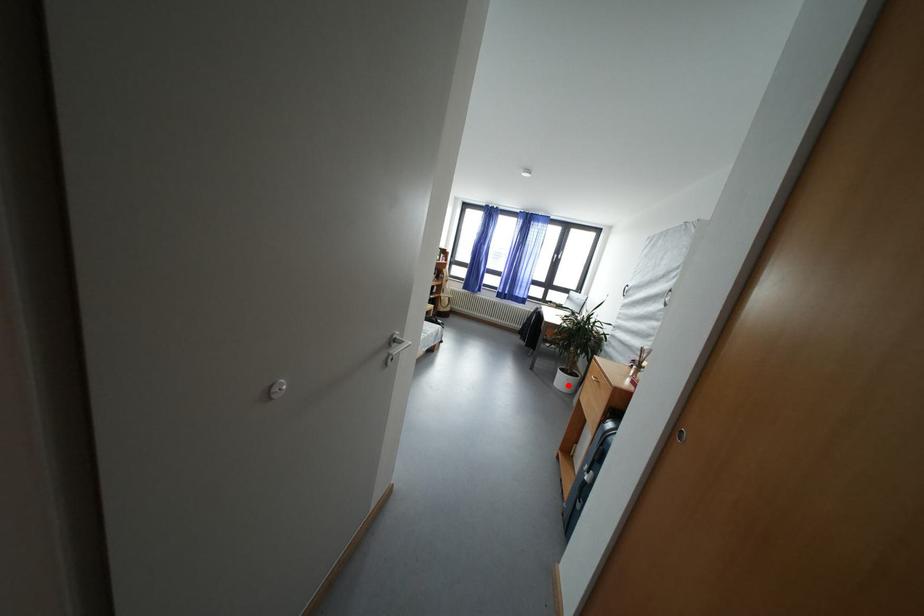
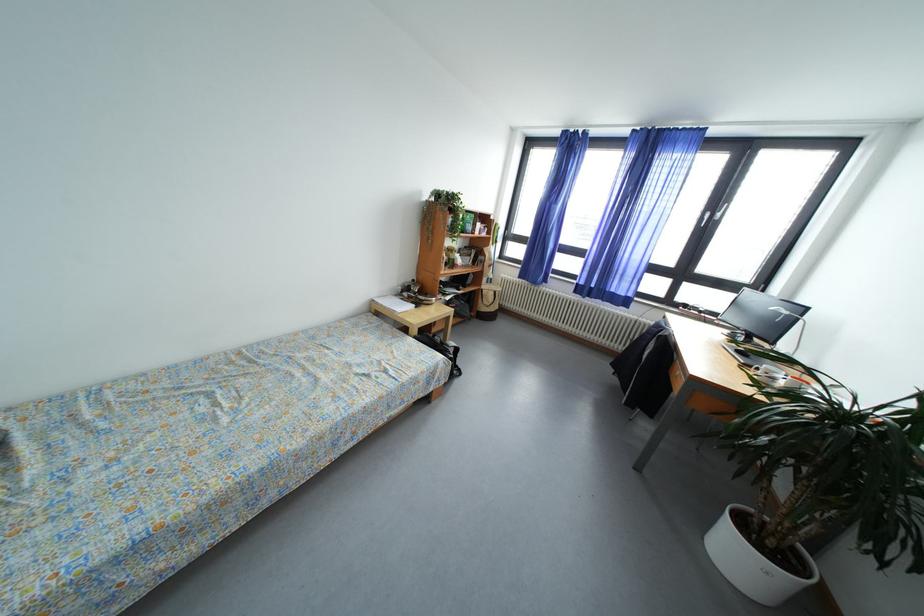
Question: I am providing you with two images of the same scene from different viewpoints. Image1 has a red point marked. In image2, the corresponding 3D location appears at what relative position? Reply with the corresponding letter.

Choices:
 (A) Closer
 (B) Farther

Answer: (B)